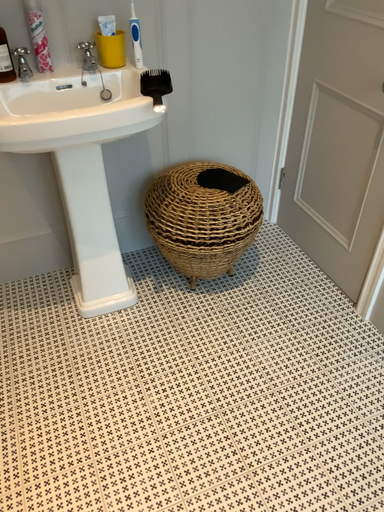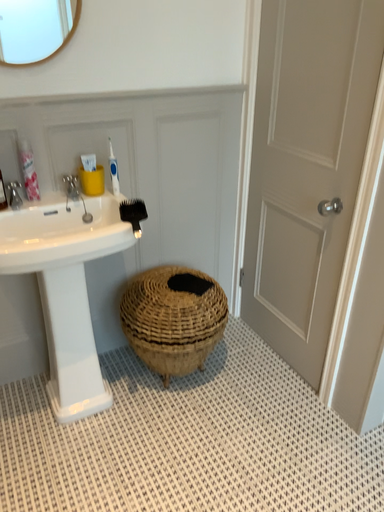
Question: How did the camera likely rotate when shooting the video?

Choices:
 (A) rotated upward
 (B) rotated downward

Answer: (A)